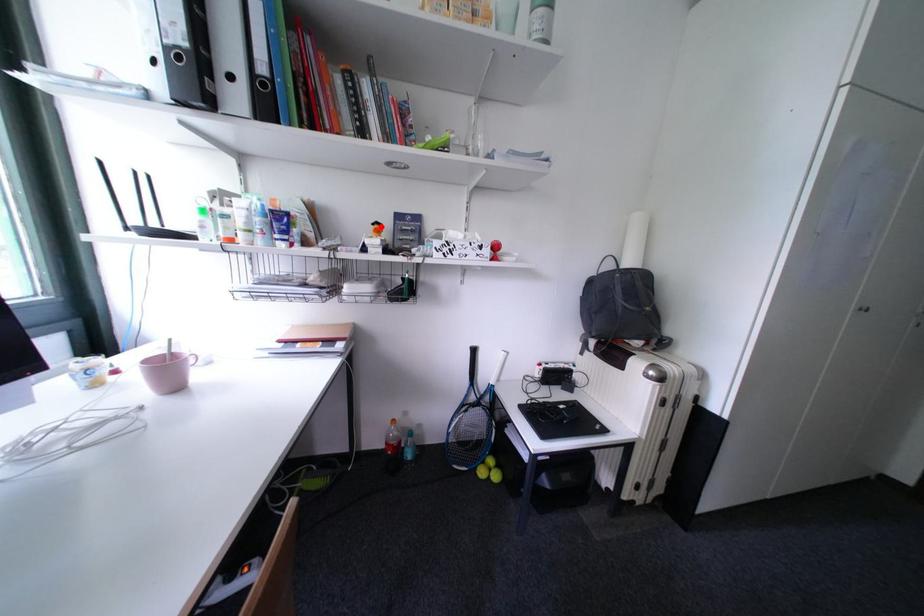
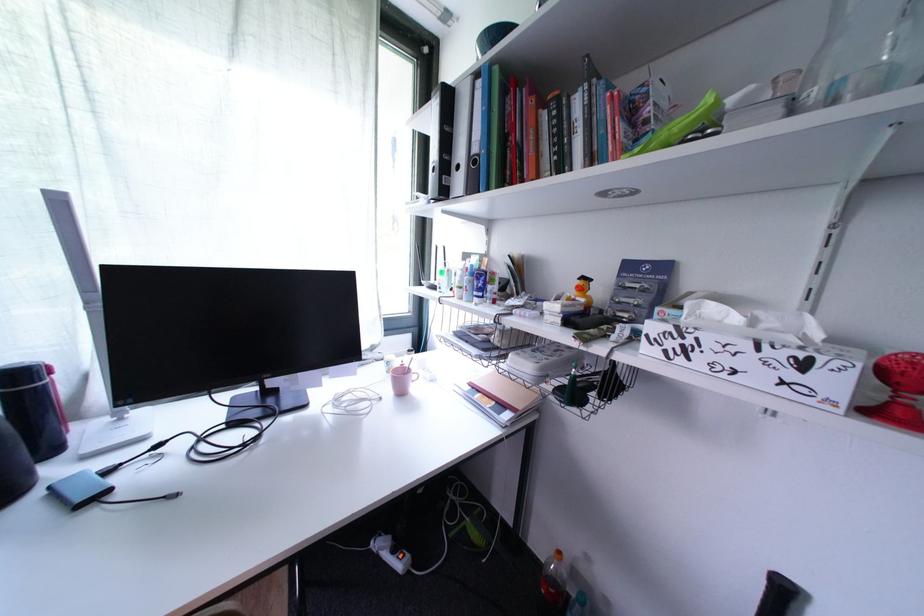
Locate, in the second image, the point that corresponds to the highlighted location in the first image.

(588, 282)